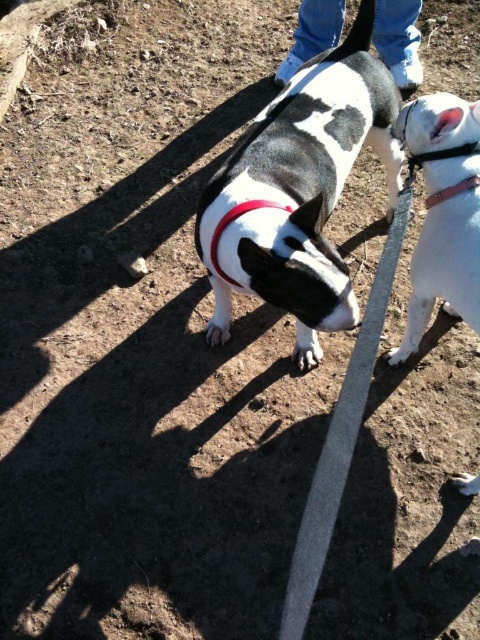
Does white matte dog at center have a larger size compared to jeans at upper center?

No, white matte dog at center is not bigger than jeans at upper center.

Find the location of `white matte dog at center`. white matte dog at center is located at coordinates (444, 214).

Between point (476, 243) and point (393, 54), which one is positioned behind?

The point (393, 54) is behind.

I want to click on white matte dog at center, so click(x=444, y=214).

Who is shorter, jeans at upper center or red leather neckband at upper right?

With less height is red leather neckband at upper right.

Does jeans at upper center appear over red leather neckband at upper right?

Correct, jeans at upper center is located above red leather neckband at upper right.

Describe the element at coordinates (398, 38) in the screenshot. The width and height of the screenshot is (480, 640). I see `jeans at upper center` at that location.

What are the coordinates of `jeans at upper center` in the screenshot? It's located at (398, 38).

Does white matte dog at center lie in front of red leather collar at center?

Yes, it is in front of red leather collar at center.

Who is positioned more to the left, white matte dog at center or red leather collar at center?

From the viewer's perspective, red leather collar at center appears more on the left side.

Is point (399, 125) in front of point (213, 250)?

No, it is not.

This screenshot has height=640, width=480. I want to click on white matte dog at center, so pyautogui.click(x=444, y=214).